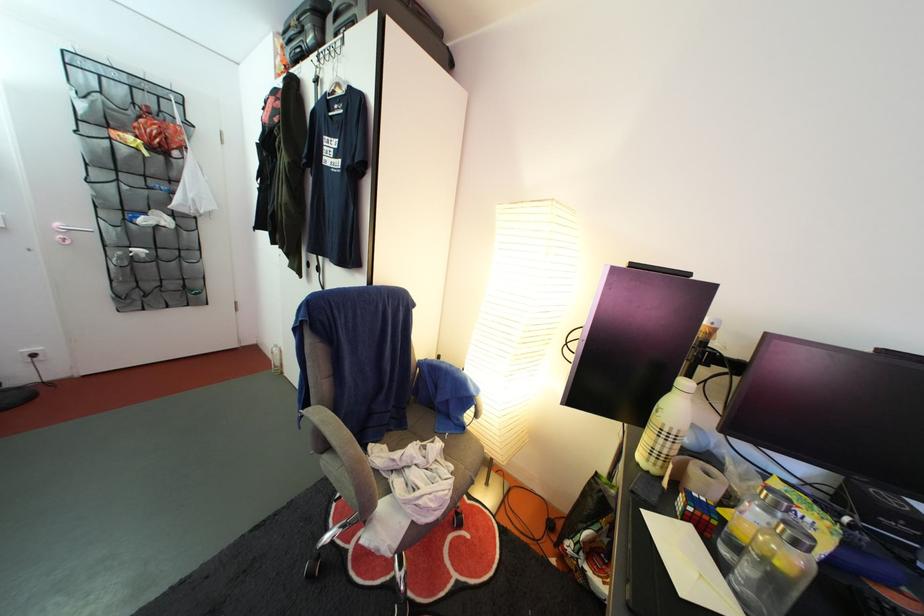
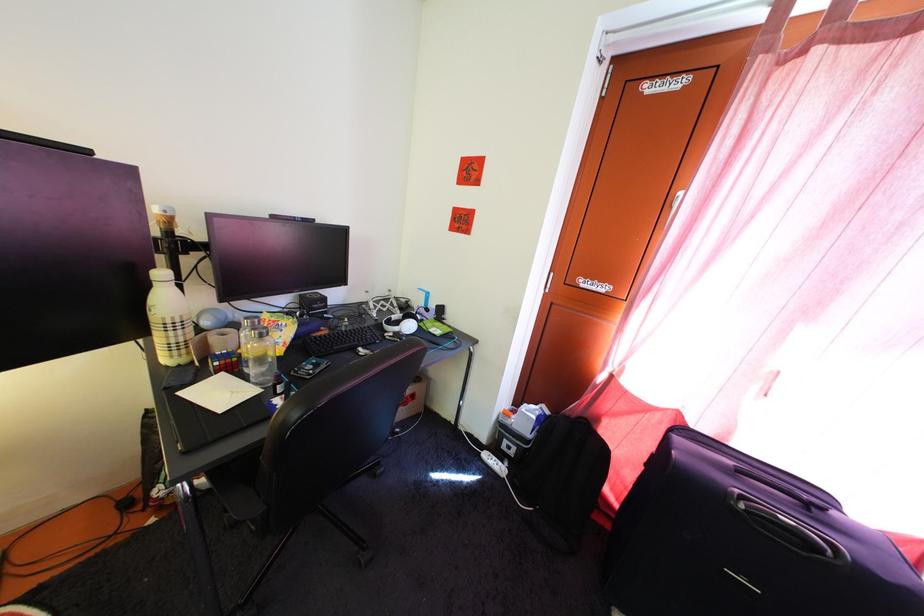
Locate, in the second image, the point that corresponds to the point at 716,483 in the first image.

(233, 342)